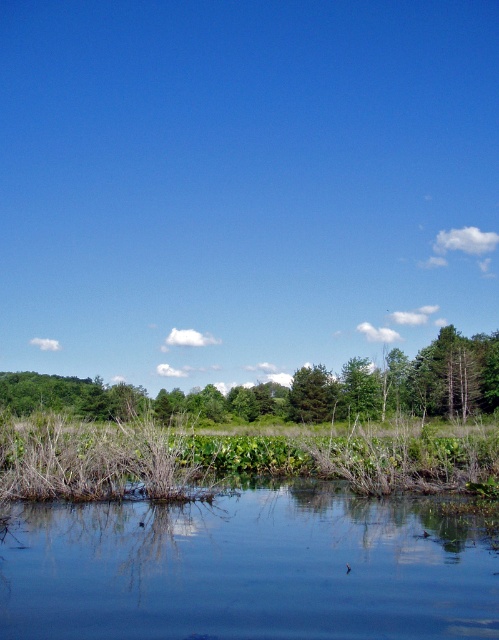
This screenshot has height=640, width=499. Identify the location of clear water at lower center. (246, 570).

Is green leafy tree at center above green matte tree at center?

Result: Correct, green leafy tree at center is located above green matte tree at center.

Is green leafy tree at center bigger than green matte tree at center?

Indeed, green leafy tree at center has a larger size compared to green matte tree at center.

The height and width of the screenshot is (640, 499). What do you see at coordinates (362, 387) in the screenshot?
I see `green leafy tree at center` at bounding box center [362, 387].

Where is `green leafy tree at center`? green leafy tree at center is located at coordinates (362, 387).

Which of these two, clear water at lower center or green leafy tree at center, stands shorter?

clear water at lower center

Between clear water at lower center and green leafy tree at center, which one has more height?

With more height is green leafy tree at center.

The width and height of the screenshot is (499, 640). Find the location of `clear water at lower center`. clear water at lower center is located at coordinates (246, 570).